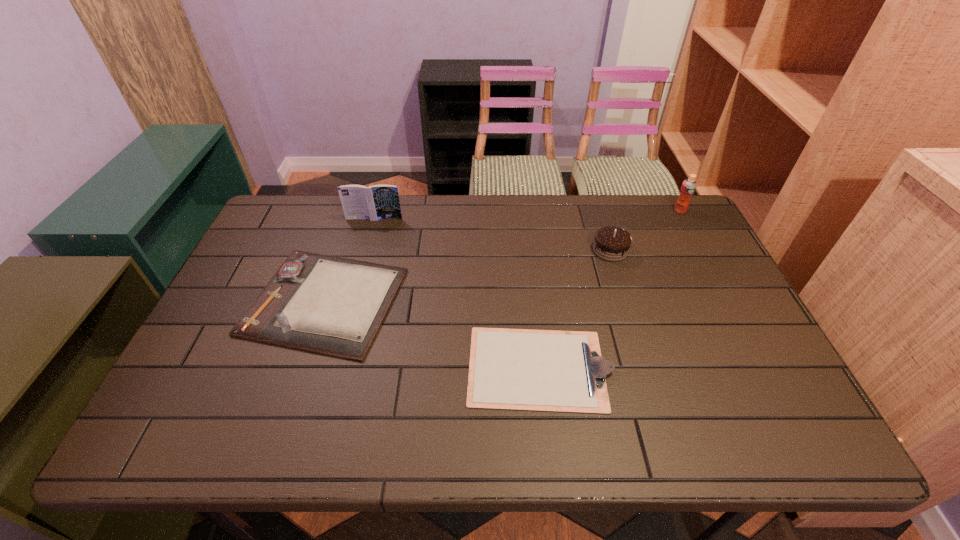
You are a GUI agent. You are given a task and a screenshot of the screen. Output one action in this format:
    pyautogui.click(x=<x>, y=<y>)
    Task: Click on the orange juice
    The image size is (960, 540).
    Given the screenshot: What is the action you would take?
    pyautogui.click(x=688, y=187)

Locate an element on the screen. The width and height of the screenshot is (960, 540). the rightmost object is located at coordinates pos(688,187).

At what (x,y) coordinates should I click in order to perform the action: click on the fourth nearest object. Please return your answer as a coordinate pair (x, y). This screenshot has height=540, width=960. Looking at the image, I should click on [x=376, y=202].

Locate an element on the screen. the third shortest object is located at coordinates (611, 243).

Image resolution: width=960 pixels, height=540 pixels. I want to click on chocolate cake, so click(x=611, y=243).

Find the location of a particular element. This screenshot has width=960, height=540. the left clipboard is located at coordinates (324, 304).

What are the coordinates of `the right clipboard` in the screenshot? It's located at (511, 369).

Image resolution: width=960 pixels, height=540 pixels. I want to click on free location located 0.160m on the front of the orange juice, so 699,246.

Image resolution: width=960 pixels, height=540 pixels. Find the location of `free location located on the front cover of the book`. free location located on the front cover of the book is located at coordinates (354, 291).

Where is `vacant region located 0.380m on the left of the third tallest object`? This screenshot has width=960, height=540. vacant region located 0.380m on the left of the third tallest object is located at coordinates (470, 250).